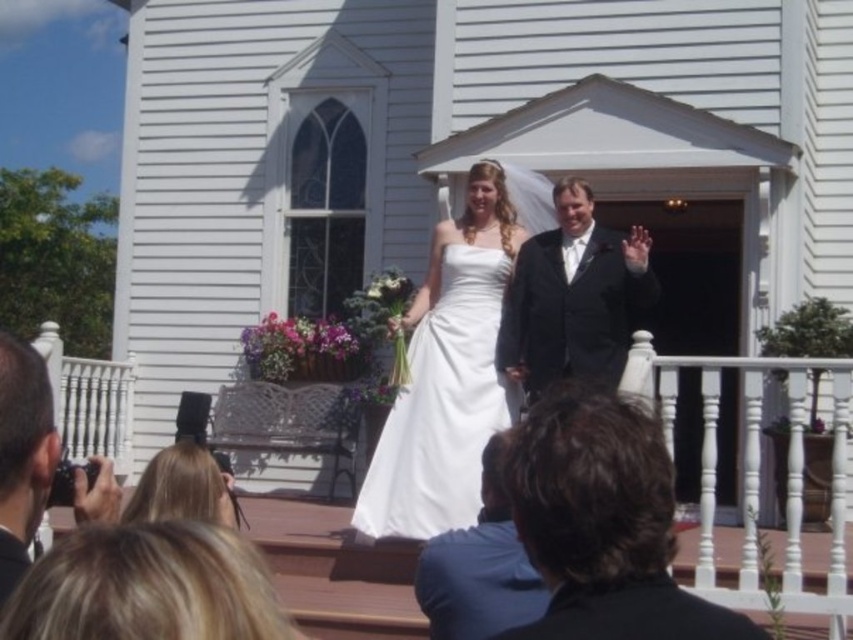
You are a photographer standing at the front of the church. You want to take a photo of the black suit at center. Where should you aim your camera?

The black suit at center is located at point 0.817 on the x axis and 0.708 on the y axis, so you should aim your camera at those coordinates to capture the black suit at center.

You are a photographer setting up for a wedding photo. You need to position a large camera tripod between the black suit at center and the white wooden porch at center. The tripod requires 1.2 meters of space to avoid hitting either subject. Based on the scene, can the tripod be placed there without obstruction?

The black suit at center is narrower than the white wooden porch at center. However, the description only provides information about their widths, not the distance between them. Without knowing the distance between the two subjects, it is impossible to determine if the tripod will fit.

In the scene shown: Based on the scene description, where is the white satin dress at center in relation to the white wooden porch at center?

The white satin dress at center is to the right of the white wooden porch at center.